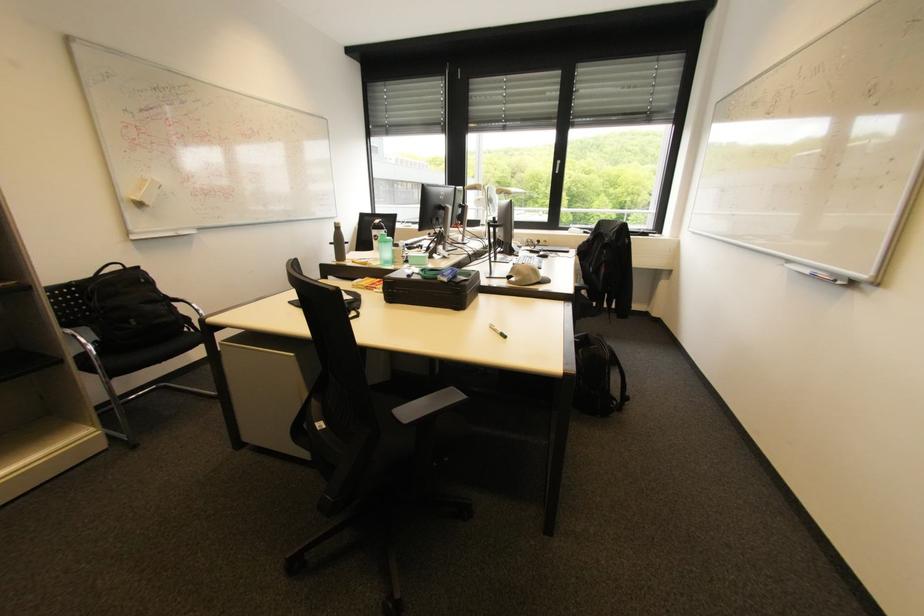
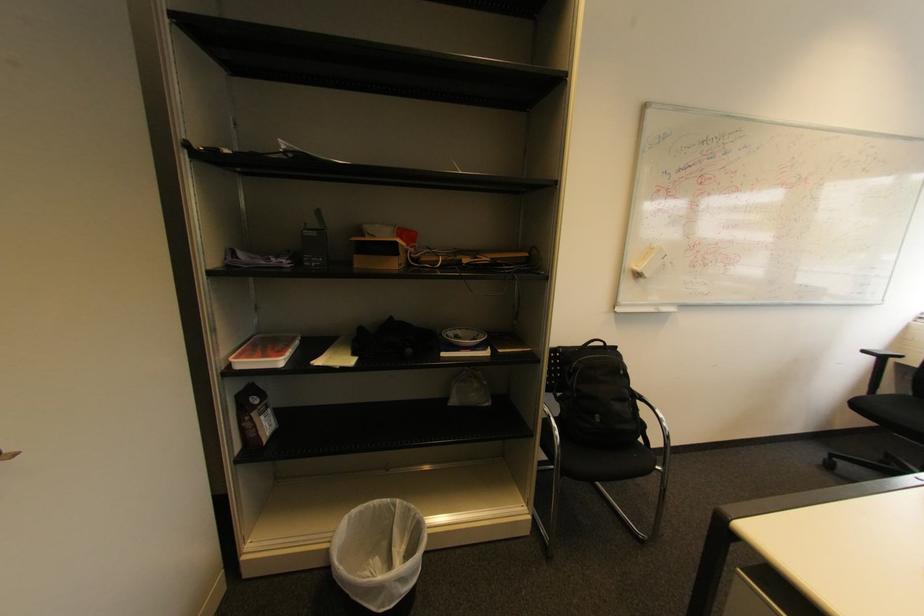
Where in the second image is the point corresponding to (146,205) from the first image?

(643, 276)